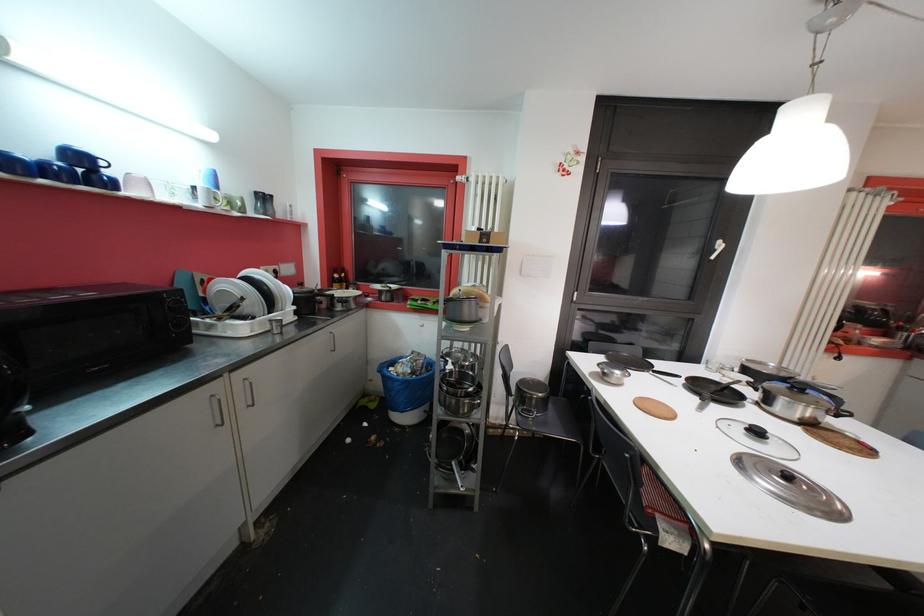
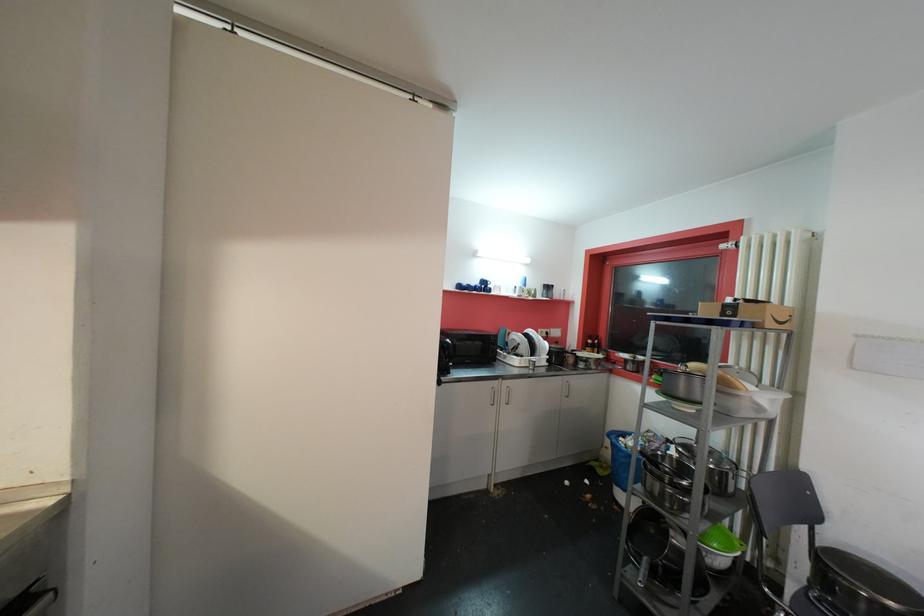
In the second image, find the point that corresponds to pixel 490 243 in the first image.

(734, 315)